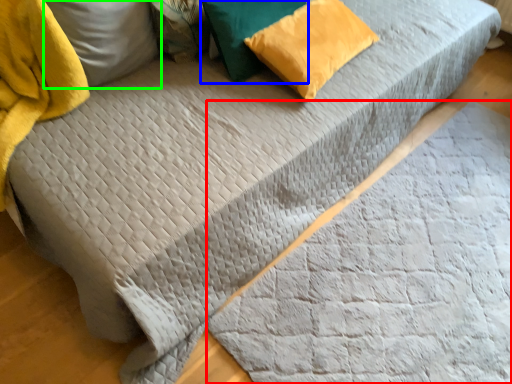
Question: Which object is the closest to the blanket (highlighted by a red box)? Choose among these: pillow (highlighted by a blue box) or pillow (highlighted by a green box).

Choices:
 (A) pillow
 (B) pillow

Answer: (A)